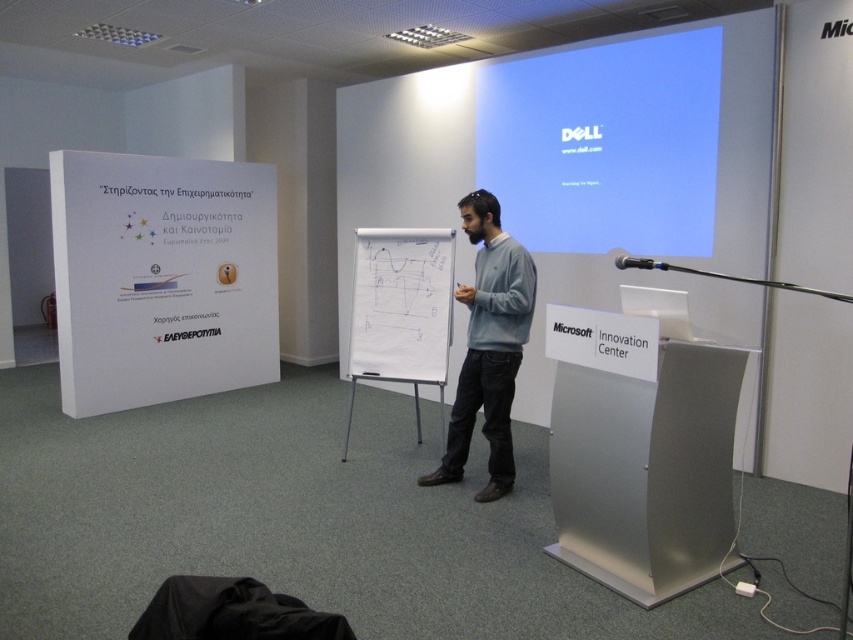
You are an attendee in the conference room and want to see both the white paperboard at left and the white glossy projection screen at upper center clearly. Which object is located lower in the image?

The white paperboard at left is located below the white glossy projection screen at upper center, so the white paperboard at left is lower in the image.

You are a presenter who just arrived at the conference room and need to set up your laptop on the silver metallic podium at center. However, there is a gray cotton sweater at center in the way. Based on the scene description, can you easily move the sweater to access the podium?

The silver metallic podium at center is to the right of the gray cotton sweater at center, so the podium is positioned to the right side of the sweater. Since the presenter can move around the left side of the sweater or shift it aside, they can easily access the podium by moving the sweater out of the way.

You are a guest in the conference room and want to see the laptop on the podium. Since the gray cotton sweater at center is blocking your view, can you see the silver metallic podium at center behind it?

The silver metallic podium at center is not as tall as the gray cotton sweater at center, so the podium is shorter. Therefore, the gray cotton sweater at center is taller and would block your view of the silver metallic podium at center behind it.